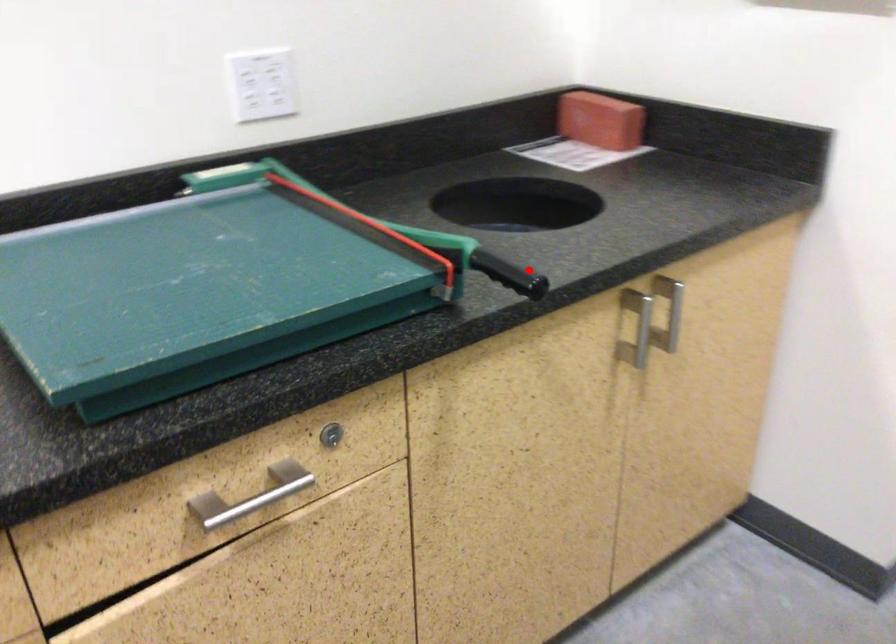
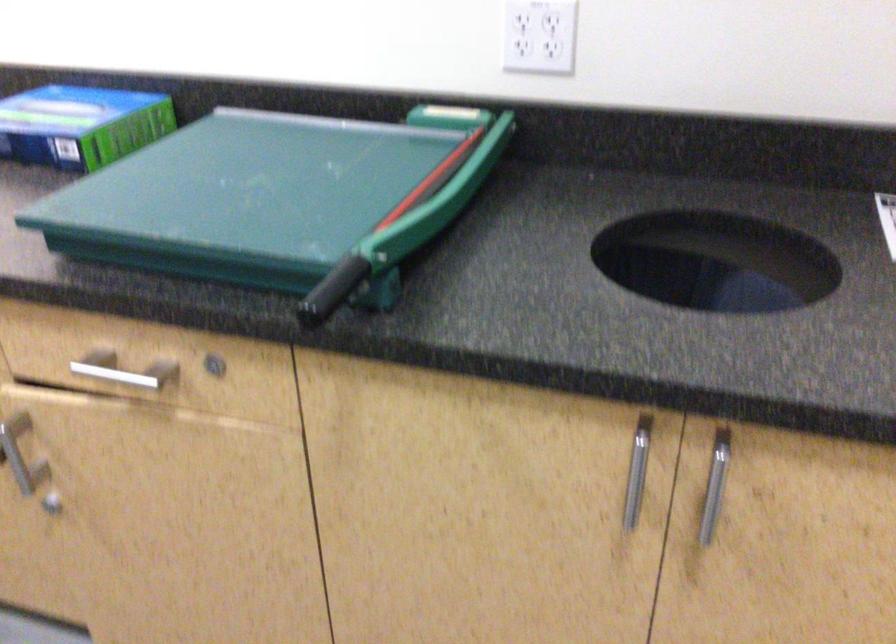
Question: I am providing you with two images of the same scene from different viewpoints. A red point is marked on the first image. At the location where the point appears in image 1, is it still visible in image 2?

Choices:
 (A) Yes
 (B) No

Answer: (A)